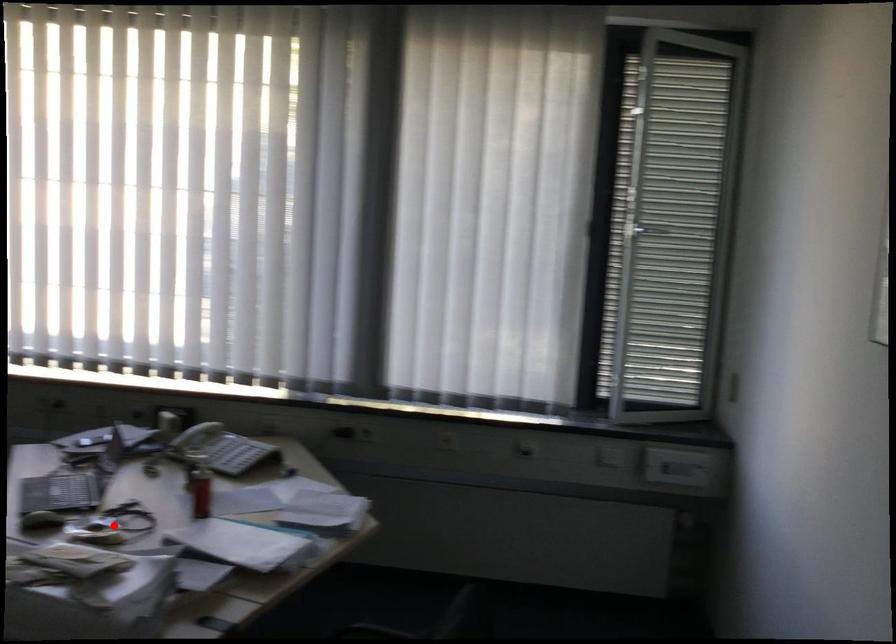
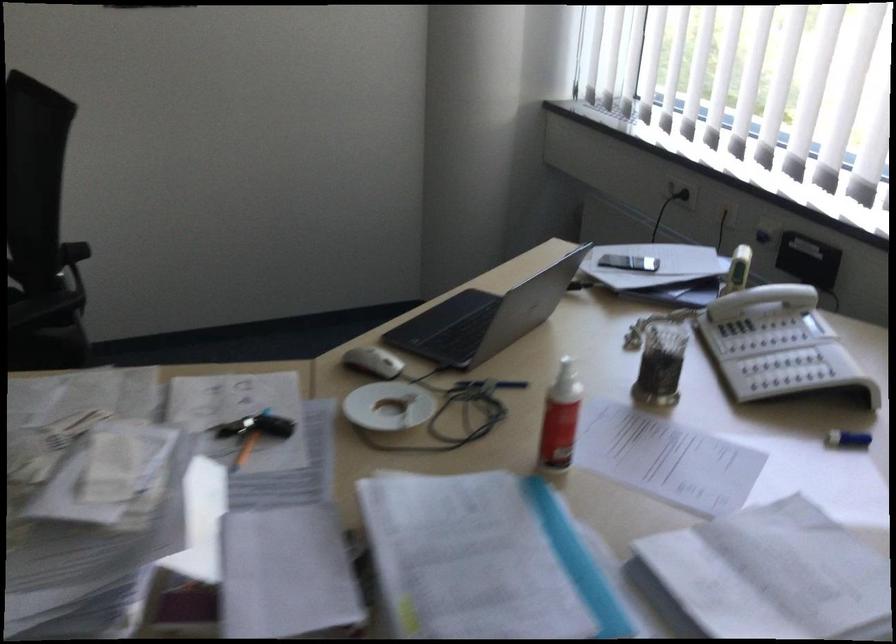
The point at the highlighted location is marked in the first image. Where is the corresponding point in the second image?

(394, 413)